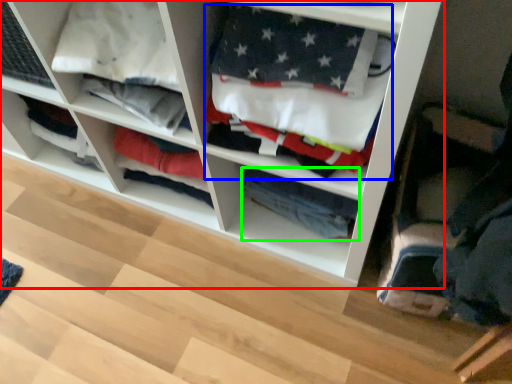
Question: Which object is the closest to the shelf (highlighted by a red box)? Choose among these: clothing (highlighted by a blue box) or clothing (highlighted by a green box).

Choices:
 (A) clothing
 (B) clothing

Answer: (A)